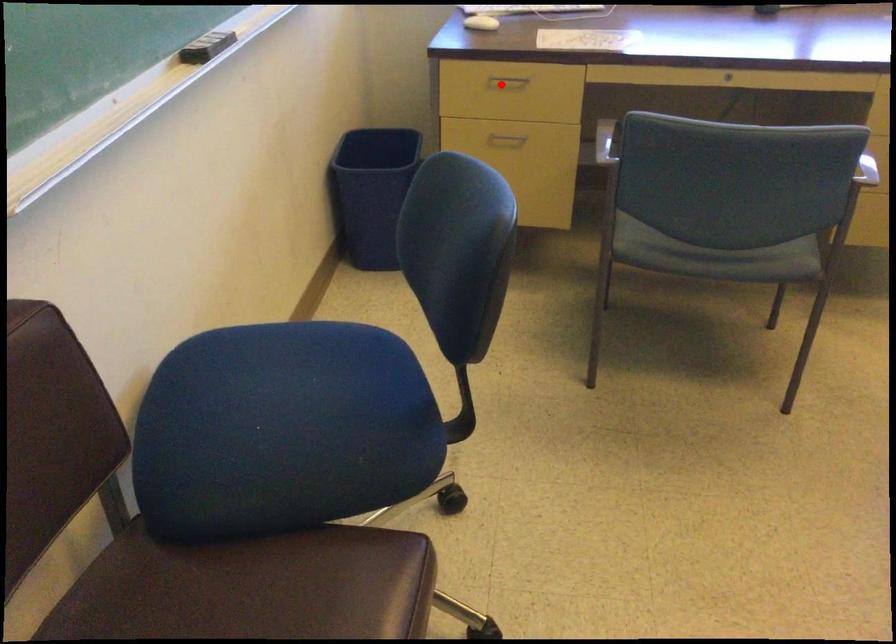
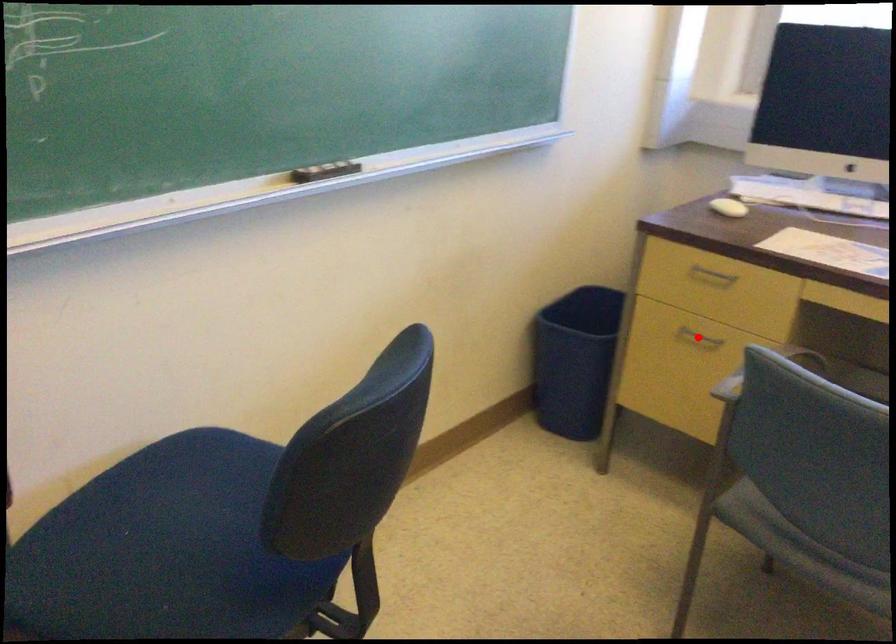
I am providing you with two images of the same scene from different viewpoints. A red point is marked on the first image and another point is marked on the second image. Is the marked point in image1 the same physical position as the marked point in image2?

No